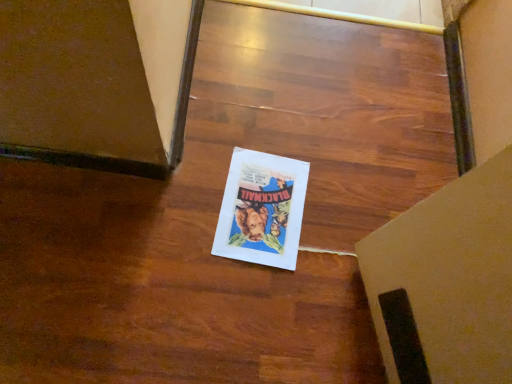
Locate an element on the screen. The width and height of the screenshot is (512, 384). vacant region under matte paper poster at center (from a real-world perspective) is located at coordinates (262, 201).